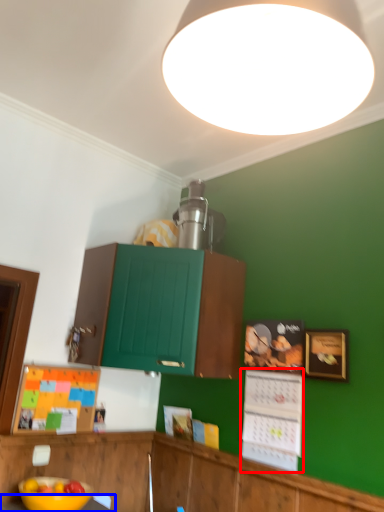
Question: Which of the following is the closest to the observer, bulletin board (highlighted by a red box) or table (highlighted by a blue box)?

Choices:
 (A) bulletin board
 (B) table

Answer: (B)